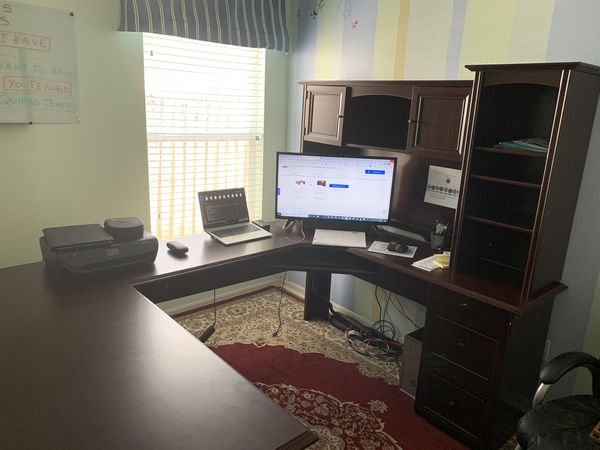
Image resolution: width=600 pixels, height=450 pixels. Find the location of `arm of chair`. arm of chair is located at coordinates (550, 374).